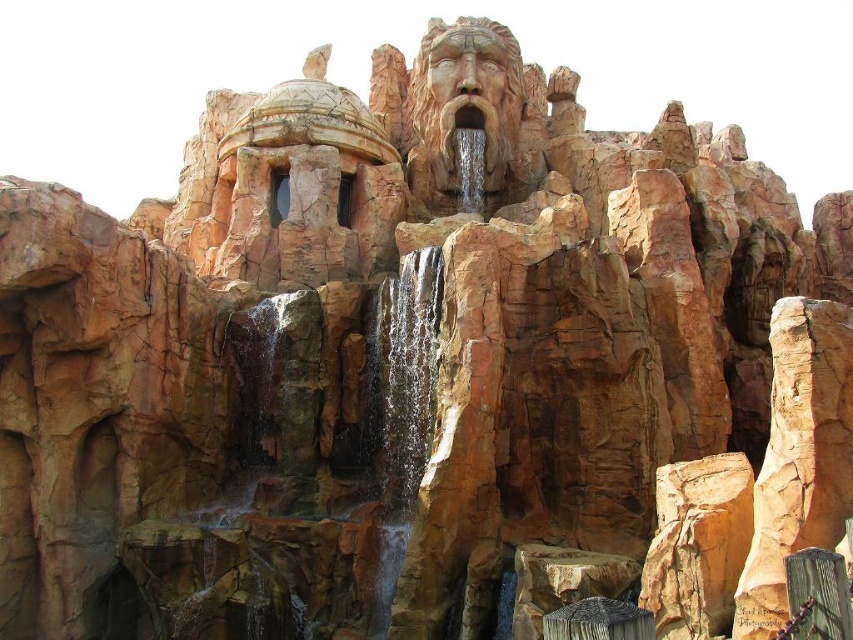
Question: Which object appears closest to the camera in this image?

Choices:
 (A) brown textured waterfall at center
 (B) clear water at center

Answer: (B)

Question: Is clear water at center closer to camera compared to brown textured waterfall at center?

Choices:
 (A) no
 (B) yes

Answer: (B)

Question: Which of the following is the farthest from the observer?

Choices:
 (A) (425, 317)
 (B) (474, 172)

Answer: (B)

Question: Is clear water at center below brown textured waterfall at center?

Choices:
 (A) no
 (B) yes

Answer: (B)

Question: Can you confirm if clear water at center is thinner than brown textured waterfall at center?

Choices:
 (A) yes
 (B) no

Answer: (B)